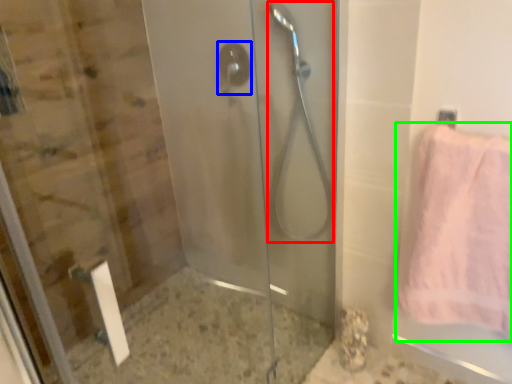
Question: Which object is the farthest from shower (highlighted by a red box)? Choose among these: shower (highlighted by a blue box) or towel (highlighted by a green box).

Choices:
 (A) shower
 (B) towel

Answer: (B)